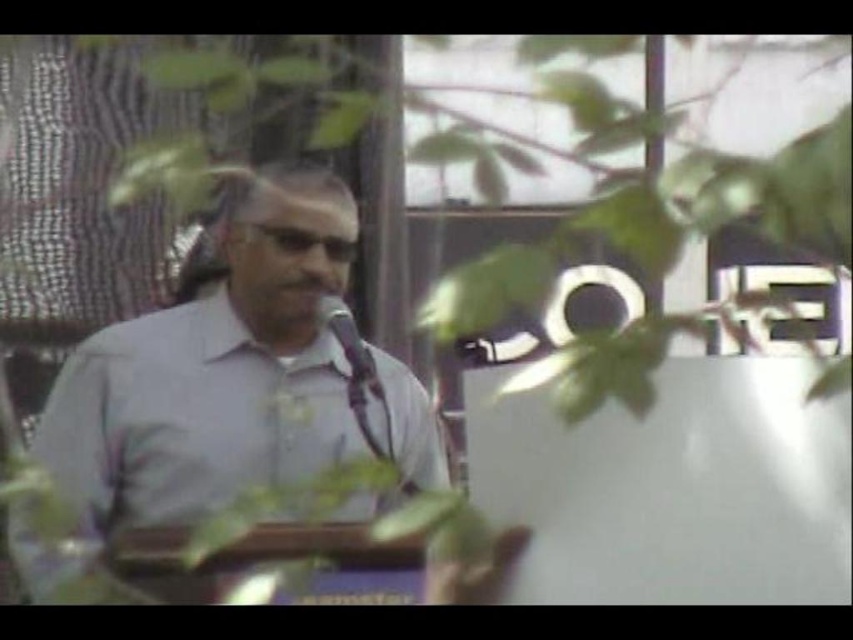
Which is below, gray matte shirt at center or metallic silver microphone at center?

gray matte shirt at center is below.

Is gray matte shirt at center smaller than metallic silver microphone at center?

Actually, gray matte shirt at center might be larger than metallic silver microphone at center.

Is point (409, 468) positioned before point (372, 362)?

No, (409, 468) is behind (372, 362).

Locate an element on the screen. The height and width of the screenshot is (640, 853). gray matte shirt at center is located at coordinates (207, 378).